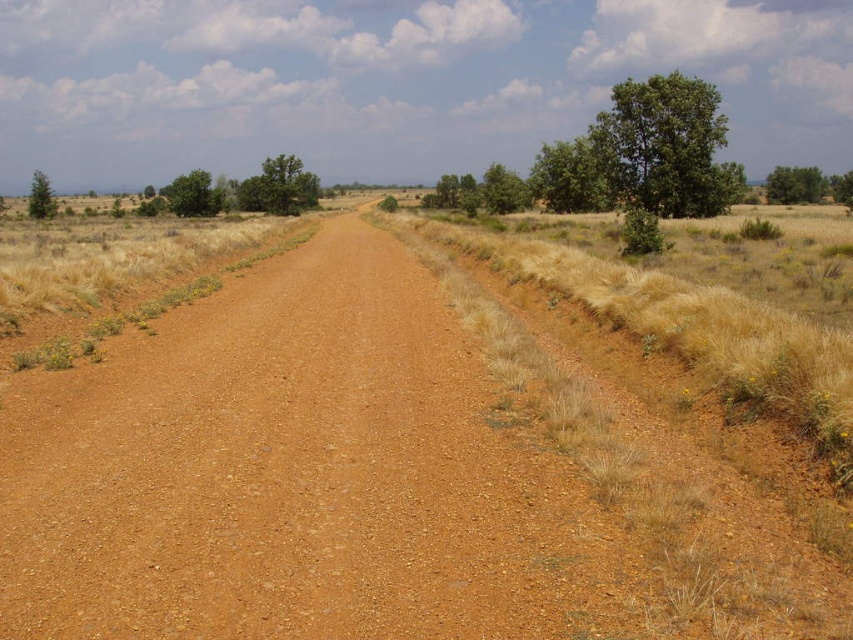
Question: Among these points, which one is nearest to the camera?

Choices:
 (A) (193, 205)
 (B) (792, 170)
 (C) (291, 170)

Answer: (A)

Question: Does green leafy tree at upper left appear over green matte tree at left?

Choices:
 (A) yes
 (B) no

Answer: (A)

Question: Is green leafy tree at upper right bigger than green matte tree at left?

Choices:
 (A) no
 (B) yes

Answer: (A)

Question: Estimate the real-world distances between objects in this image. Which object is farther from the green leafy tree at center?

Choices:
 (A) brown gravel dirt track at center
 (B) green leafy tree at upper left
 (C) green matte tree at left
 (D) green leafy tree at upper right

Answer: (A)

Question: Can you confirm if brown gravel dirt track at center is positioned to the right of green leafy tree at upper left?

Choices:
 (A) no
 (B) yes

Answer: (B)

Question: Which of the following is the closest to the observer?

Choices:
 (A) pyautogui.click(x=190, y=208)
 (B) pyautogui.click(x=41, y=202)

Answer: (B)